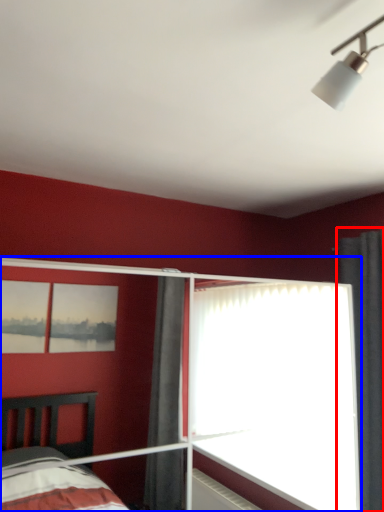
Question: Which object appears farthest to the camera in this image, curtain (highlighted by a red box) or glass door (highlighted by a blue box)?

Choices:
 (A) curtain
 (B) glass door

Answer: (A)